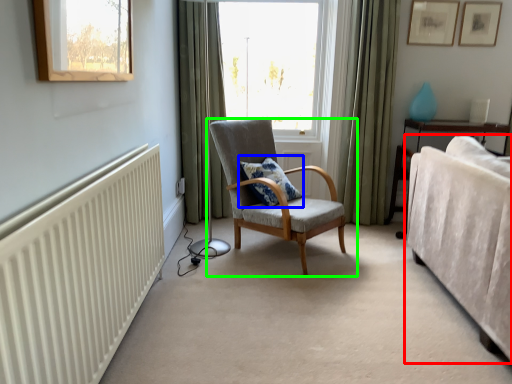
Question: Which object is the farthest from studio couch (highlighted by a red box)? Choose among these: pillow (highlighted by a blue box) or chair (highlighted by a green box).

Choices:
 (A) pillow
 (B) chair

Answer: (A)